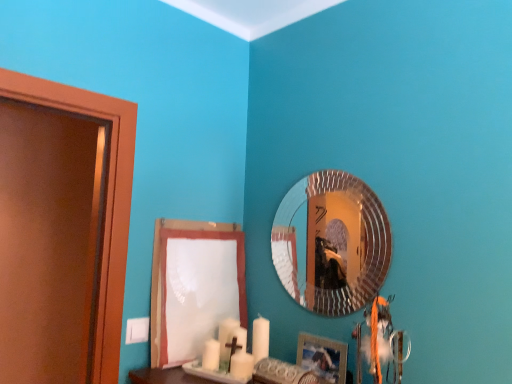
Question: Is silver textured mirror at upper center far from white paper at lower center?

Choices:
 (A) no
 (B) yes

Answer: (A)

Question: Is silver textured mirror at upper center shorter than white paper at lower center?

Choices:
 (A) yes
 (B) no

Answer: (A)

Question: Is the surface of silver textured mirror at upper center in direct contact with white paper at lower center?

Choices:
 (A) no
 (B) yes

Answer: (A)

Question: Does silver textured mirror at upper center come in front of white paper at lower center?

Choices:
 (A) yes
 (B) no

Answer: (A)

Question: Considering the relative sizes of silver textured mirror at upper center and white paper at lower center in the image provided, is silver textured mirror at upper center thinner than white paper at lower center?

Choices:
 (A) yes
 (B) no

Answer: (A)

Question: From the image's perspective, is white paper at lower center above or below silver textured mirror at upper center?

Choices:
 (A) above
 (B) below

Answer: (B)

Question: Is white paper at lower center inside or outside of silver textured mirror at upper center?

Choices:
 (A) inside
 (B) outside

Answer: (B)

Question: Is white paper at lower center in front of or behind silver textured mirror at upper center in the image?

Choices:
 (A) front
 (B) behind

Answer: (B)

Question: Is point (158, 226) closer or farther from the camera than point (291, 231)?

Choices:
 (A) farther
 (B) closer

Answer: (B)

Question: Which is correct: silver textured mirror at upper center is inside white paper at lower center, or outside of it?

Choices:
 (A) inside
 (B) outside

Answer: (B)

Question: Considering the positions of point 289,201 and point 230,273, is point 289,201 closer or farther from the camera than point 230,273?

Choices:
 (A) farther
 (B) closer

Answer: (B)

Question: From the image's perspective, is silver textured mirror at upper center located above or below white paper at lower center?

Choices:
 (A) above
 (B) below

Answer: (A)

Question: Is silver textured mirror at upper center in front of or behind white paper at lower center in the image?

Choices:
 (A) behind
 (B) front

Answer: (B)

Question: Is silver textured mirror at upper center to the left or to the right of wooden picture frame at lower right in the image?

Choices:
 (A) right
 (B) left

Answer: (A)

Question: Which is correct: silver textured mirror at upper center is inside wooden picture frame at lower right, or outside of it?

Choices:
 (A) outside
 (B) inside

Answer: (A)